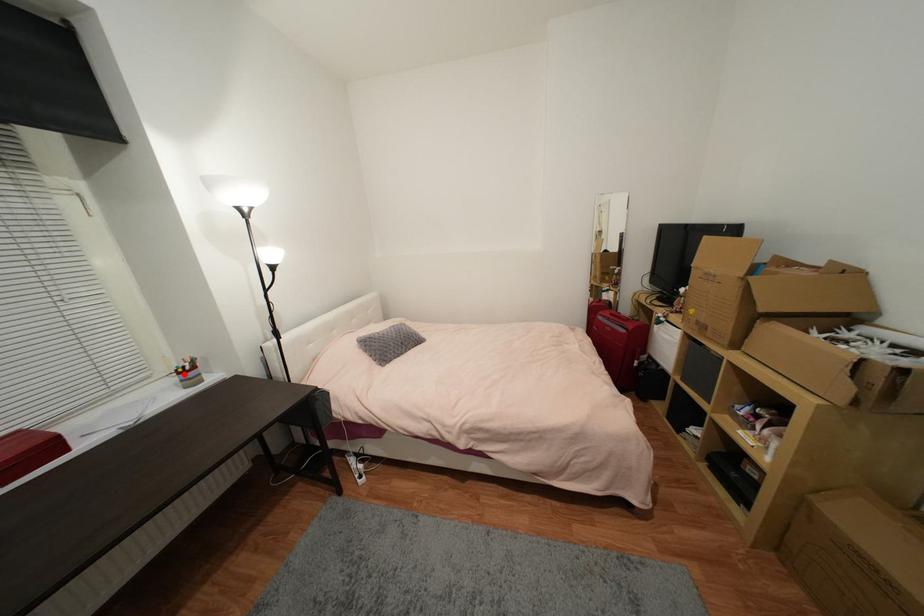
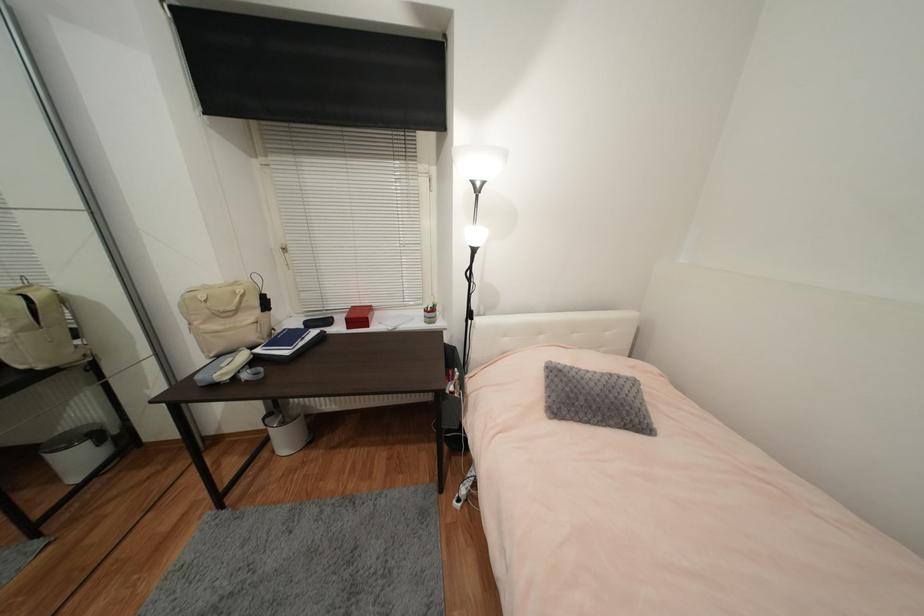
Locate, in the second image, the point that corresponds to the highlighted location in the first image.

(430, 312)